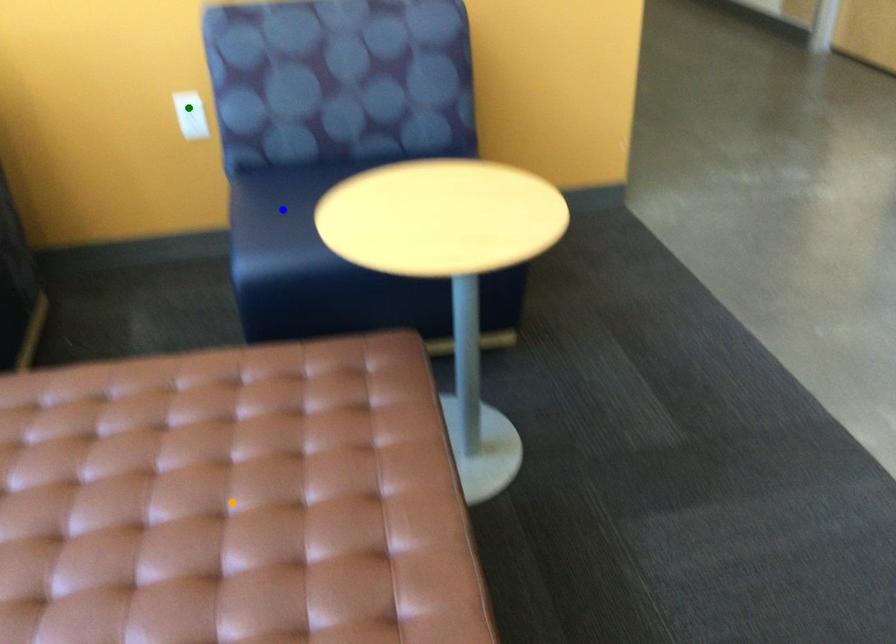
Order these from nearest to farthest:
1. orange point
2. green point
3. blue point

Answer: green point, blue point, orange point